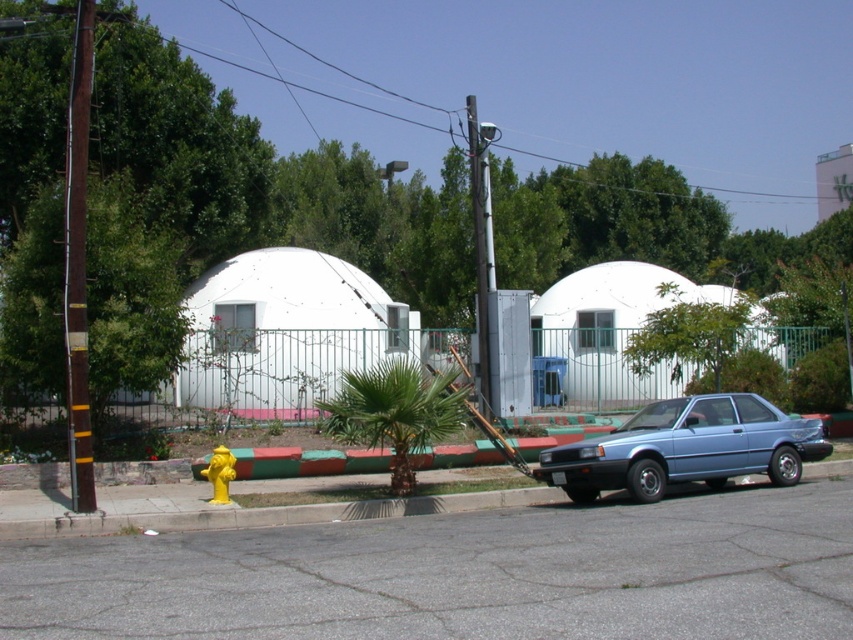
Can you confirm if white matte pickup truck at center is positioned to the right of brown wooden pole at left?

Yes, white matte pickup truck at center is to the right of brown wooden pole at left.

In the scene shown: Between white matte pickup truck at center and brown wooden pole at left, which one is positioned higher?

brown wooden pole at left

Is point (567, 321) behind point (80, 410)?

Yes, point (567, 321) is farther from viewer.

This screenshot has height=640, width=853. I want to click on white matte pickup truck at center, so click(x=611, y=332).

Between white matte dome at center and white matte pickup truck at center, which one has more height?

Standing taller between the two is white matte pickup truck at center.

Who is more distant from viewer, (189, 360) or (556, 284)?

The point (556, 284) is more distant.

Is point (404, 346) more distant than point (621, 380)?

No, (404, 346) is closer to viewer.

Locate an element on the screen. This screenshot has width=853, height=640. white matte dome at center is located at coordinates (283, 332).

Does white matte dome at center appear over blue metallic car at lower right?

Yes, white matte dome at center is above blue metallic car at lower right.

Which of these two, white matte dome at center or blue metallic car at lower right, stands shorter?

Standing shorter between the two is white matte dome at center.

Find the location of a particular element. white matte dome at center is located at coordinates (283, 332).